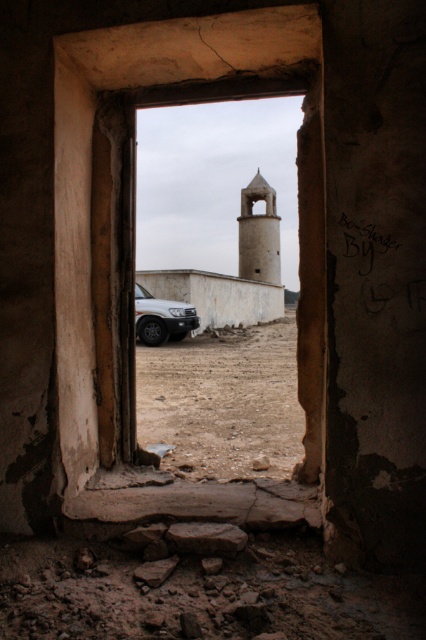
Question: Is brown concrete window frame at center below smooth beige tower at center?

Choices:
 (A) yes
 (B) no

Answer: (A)

Question: Which point appears farthest from the camera in this image?

Choices:
 (A) (199, 472)
 (B) (313, 8)

Answer: (A)

Question: Which point is closer to the camera?

Choices:
 (A) brown sandy dirt at center
 (B) smooth beige tower at center

Answer: (A)

Question: From the image, what is the correct spatial relationship of brown concrete window frame at center in relation to sandy beige metallic car at center?

Choices:
 (A) right
 (B) left

Answer: (A)

Question: Is brown sandy dirt at center thinner than sandy beige metallic car at center?

Choices:
 (A) yes
 (B) no

Answer: (B)

Question: Which object is farther from the camera taking this photo?

Choices:
 (A) brown concrete window frame at center
 (B) smooth beige tower at center

Answer: (B)